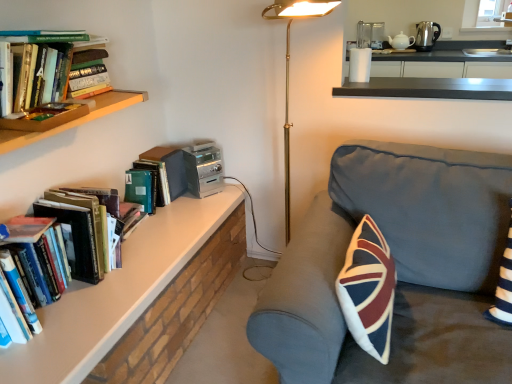
Locate an element on the screen. vacant space in between hardcover books at left, the third book from the back, and hardcover book at upper left, which appears as the third book when viewed from the front is located at coordinates (153, 226).